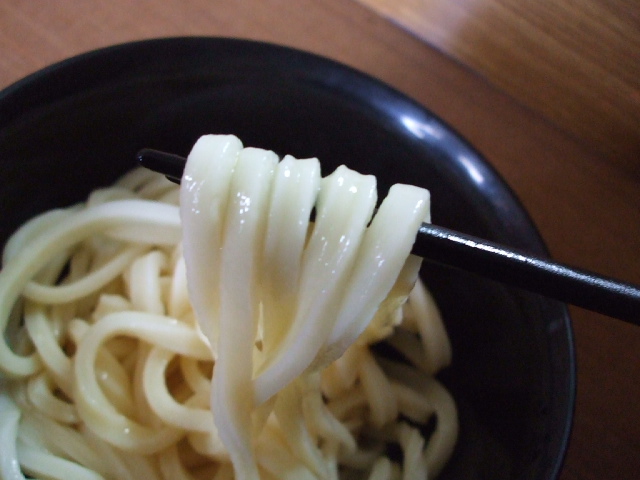
You are a GUI agent. You are given a task and a screenshot of the screen. Output one action in this format:
    pyautogui.click(x=<x>, y=<y>)
    Task: Click on the black bowl
    The width and height of the screenshot is (640, 480).
    Given the screenshot: What is the action you would take?
    pyautogui.click(x=32, y=151), pyautogui.click(x=109, y=80), pyautogui.click(x=276, y=92), pyautogui.click(x=403, y=136), pyautogui.click(x=472, y=207), pyautogui.click(x=493, y=334), pyautogui.click(x=496, y=407)